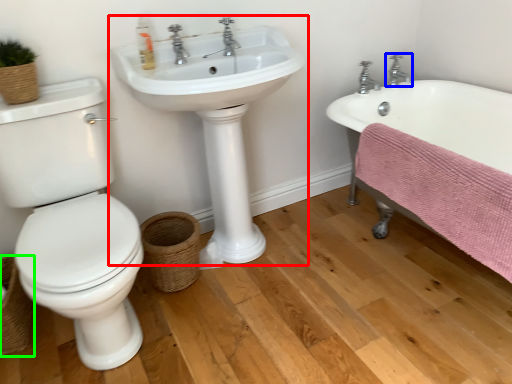
Question: Based on their relative distances, which object is farther from sink (highlighted by a red box)? Choose from tap (highlighted by a blue box) and basket (highlighted by a green box).

Choices:
 (A) tap
 (B) basket

Answer: (A)